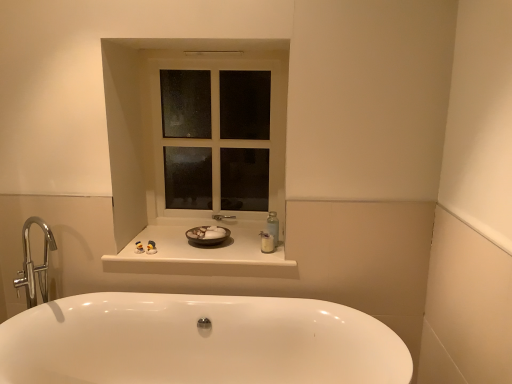
You are a GUI agent. You are given a task and a screenshot of the screen. Output one action in this format:
    pyautogui.click(x=<x>, y=<y>)
    Task: Click on the blank space situated above brown matte bowl at center (from a real-world perspective)
    This screenshot has height=384, width=512.
    Given the screenshot: What is the action you would take?
    pyautogui.click(x=207, y=234)